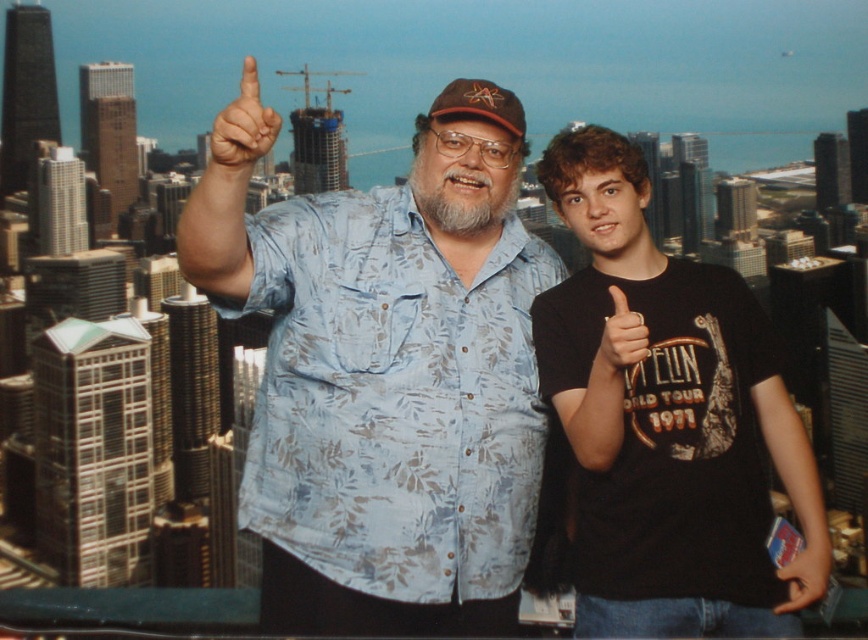
Can you confirm if matte black thumb at center is positioned below matte black hand at lower right?

Actually, matte black thumb at center is above matte black hand at lower right.

From the picture: Does matte black thumb at center appear on the left side of matte black hand at lower right?

Yes, matte black thumb at center is to the left of matte black hand at lower right.

Which is behind, point (609, 358) or point (784, 556)?

Positioned behind is point (609, 358).

You are a GUI agent. You are given a task and a screenshot of the screen. Output one action in this format:
    pyautogui.click(x=<x>, y=<y>)
    Task: Click on the matte black thumb at center
    The image size is (868, 640).
    Given the screenshot: What is the action you would take?
    pyautogui.click(x=621, y=337)

Does black t-shirt at right have a greater width compared to matte black thumb at center?

Correct, the width of black t-shirt at right exceeds that of matte black thumb at center.

You are a GUI agent. You are given a task and a screenshot of the screen. Output one action in this format:
    pyautogui.click(x=<x>, y=<y>)
    Task: Click on the black t-shirt at right
    
    Given the screenshot: What is the action you would take?
    pyautogui.click(x=669, y=422)

Locate an element on the screen. black t-shirt at right is located at coordinates (669, 422).

Identify the location of matte blue shirt at upper center. This screenshot has width=868, height=640. (242, 129).

Does point (238, 140) come farther from viewer compared to point (794, 550)?

No, (238, 140) is closer to viewer.

Find the location of `matte blue shirt at upper center`. matte blue shirt at upper center is located at coordinates (242, 129).

Find the location of `matte blue shirt at upper center`. matte blue shirt at upper center is located at coordinates (242, 129).